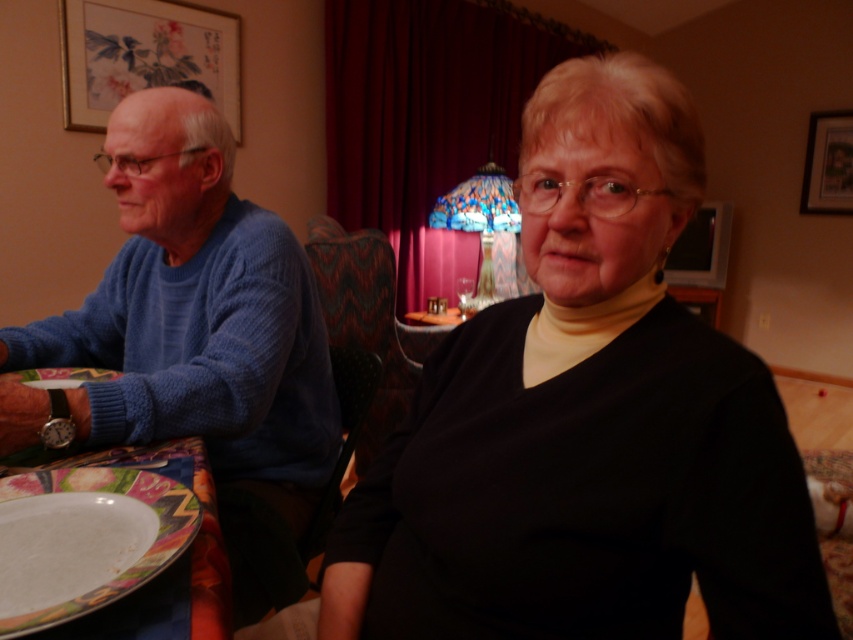
You are sitting at the table in the image and want to reach for an object located at point (670, 164). Is this point closer to you than point (833, 195)?

Yes, the point (670, 164) is in front of point (833, 195), so it is closer to you.